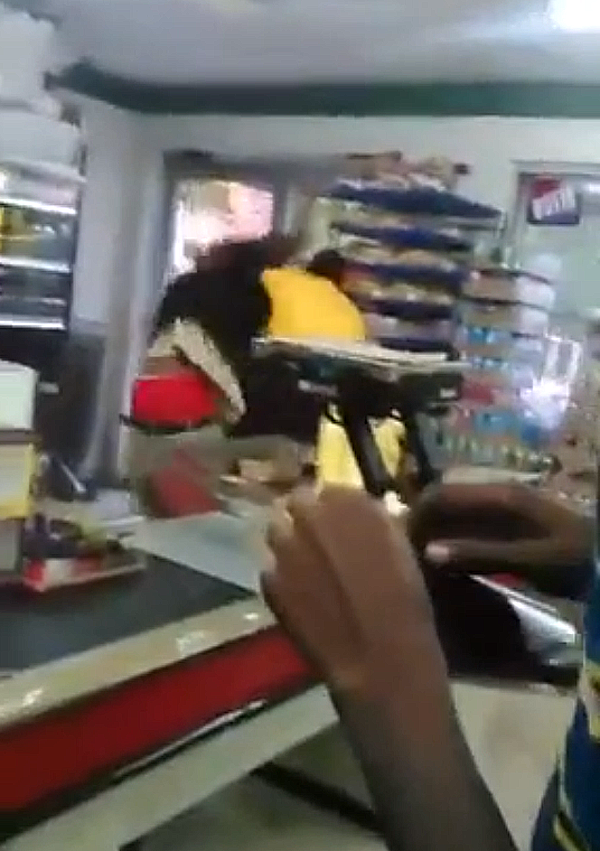
Identify the location of area to enter room. This screenshot has width=600, height=851. (196, 208).